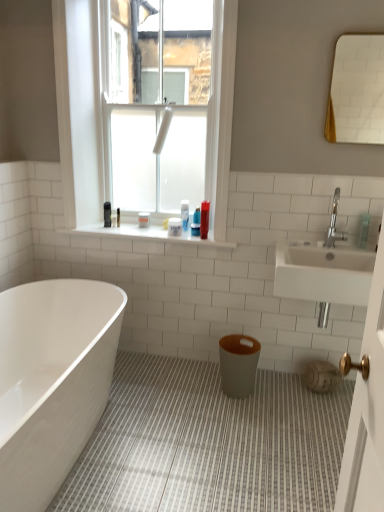
Where is `free space to the left of white plastic container at upper center, arranged as the second toiletry when viewed from the left`? free space to the left of white plastic container at upper center, arranged as the second toiletry when viewed from the left is located at coordinates (157, 228).